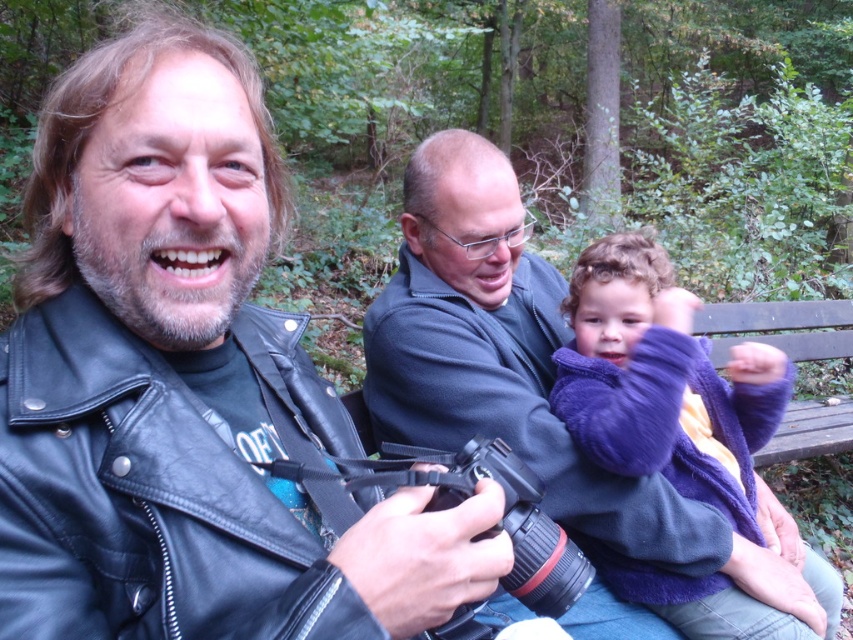
You are standing in front of the forest scene and want to locate the black leather jacket at left. According to the coordinates provided, where would you look to find it?

The black leather jacket at left is located at point 0.606 on the x axis and 0.224 on the y axis.

You are a photographer trying to capture a photo of the black leather jacket at left and the purple fleece jacket at center. Based on their positions, which jacket is closer to the camera?

The black leather jacket at left is located above the purple fleece jacket at center, so it is closer to the camera.

You are trying to locate the dark blue fleece at center in the forest scene. According to the coordinates provided, where exactly is it positioned?

The dark blue fleece at center is located at point 0.595 on the x axis and 0.625 on the y axis.